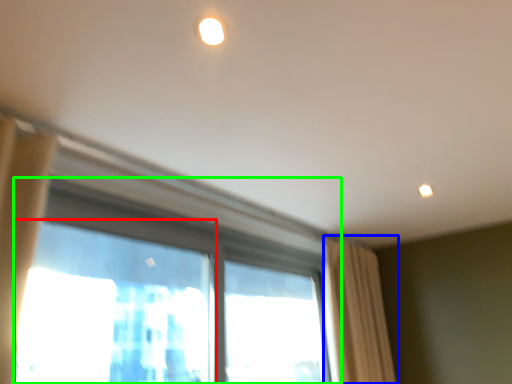
Question: Considering the real-world distances, which object is farthest from window screen (highlighted by a red box)? curtain (highlighted by a blue box) or window (highlighted by a green box)?

Choices:
 (A) curtain
 (B) window

Answer: (A)